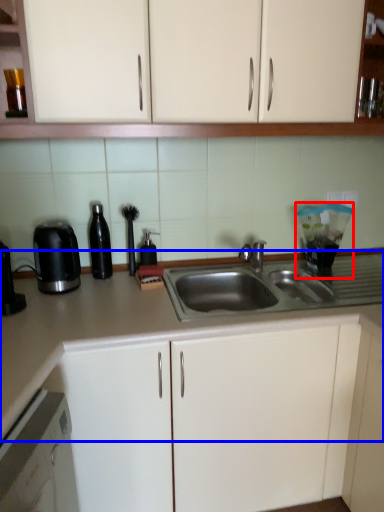
Question: Among these objects, which one is nearest to the camera, appliance (highlighted by a red box) or countertop (highlighted by a blue box)?

Choices:
 (A) appliance
 (B) countertop

Answer: (B)